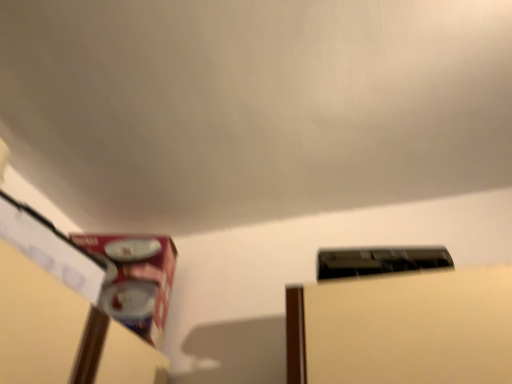
Question: Does black glossy water heater at upper right, arranged as the first water heater when viewed from the right, turn towards metallic silver water heater at lower left, which is counted as the first water heater, starting from the back?

Choices:
 (A) yes
 (B) no

Answer: (B)

Question: Considering the relative positions of black glossy water heater at upper right, the second water heater positioned from the back, and metallic silver water heater at lower left, the first water heater from the left, in the image provided, is black glossy water heater at upper right, the second water heater positioned from the back, behind metallic silver water heater at lower left, the first water heater from the left,?

Choices:
 (A) no
 (B) yes

Answer: (A)

Question: Considering the relative sizes of black glossy water heater at upper right, the second water heater positioned from the back, and metallic silver water heater at lower left, which is counted as the second water heater, starting from the front, in the image provided, is black glossy water heater at upper right, the second water heater positioned from the back, thinner than metallic silver water heater at lower left, which is counted as the second water heater, starting from the front,?

Choices:
 (A) yes
 (B) no

Answer: (A)

Question: Can you confirm if black glossy water heater at upper right, arranged as the second water heater when viewed from the left, is positioned to the right of metallic silver water heater at lower left, the first water heater from the left?

Choices:
 (A) yes
 (B) no

Answer: (A)

Question: Can we say black glossy water heater at upper right, arranged as the second water heater when viewed from the left, lies outside metallic silver water heater at lower left, the first water heater from the left?

Choices:
 (A) no
 (B) yes

Answer: (B)

Question: Would you say metallic silver water heater at lower left, the first water heater from the left, is part of black glossy water heater at upper right, arranged as the first water heater when viewed from the right,'s contents?

Choices:
 (A) yes
 (B) no

Answer: (B)

Question: Considering the relative sizes of metallic silver water heater at lower left, which is counted as the first water heater, starting from the back, and black glossy water heater at upper right, arranged as the second water heater when viewed from the left, in the image provided, is metallic silver water heater at lower left, which is counted as the first water heater, starting from the back, thinner than black glossy water heater at upper right, arranged as the second water heater when viewed from the left,?

Choices:
 (A) no
 (B) yes

Answer: (A)

Question: Is metallic silver water heater at lower left, the first water heater from the left, outside of black glossy water heater at upper right, which is the 1th water heater from front to back?

Choices:
 (A) yes
 (B) no

Answer: (A)

Question: From the image's perspective, is metallic silver water heater at lower left, the first water heater from the left, above black glossy water heater at upper right, arranged as the first water heater when viewed from the right?

Choices:
 (A) yes
 (B) no

Answer: (B)

Question: Is metallic silver water heater at lower left, the first water heater from the left, looking in the opposite direction of black glossy water heater at upper right, arranged as the second water heater when viewed from the left?

Choices:
 (A) no
 (B) yes

Answer: (A)

Question: From the image's perspective, is metallic silver water heater at lower left, which is counted as the first water heater, starting from the back, located beneath black glossy water heater at upper right, the second water heater positioned from the back?

Choices:
 (A) no
 (B) yes

Answer: (B)

Question: Can you confirm if metallic silver water heater at lower left, the first water heater from the left, is shorter than black glossy water heater at upper right, the second water heater positioned from the back?

Choices:
 (A) no
 (B) yes

Answer: (A)

Question: Considering the relative positions of metallic silver water heater at lower left, the first water heater from the left, and black glossy water heater at upper right, arranged as the first water heater when viewed from the right, in the image provided, is metallic silver water heater at lower left, the first water heater from the left, to the left or to the right of black glossy water heater at upper right, arranged as the first water heater when viewed from the right,?

Choices:
 (A) right
 (B) left

Answer: (B)